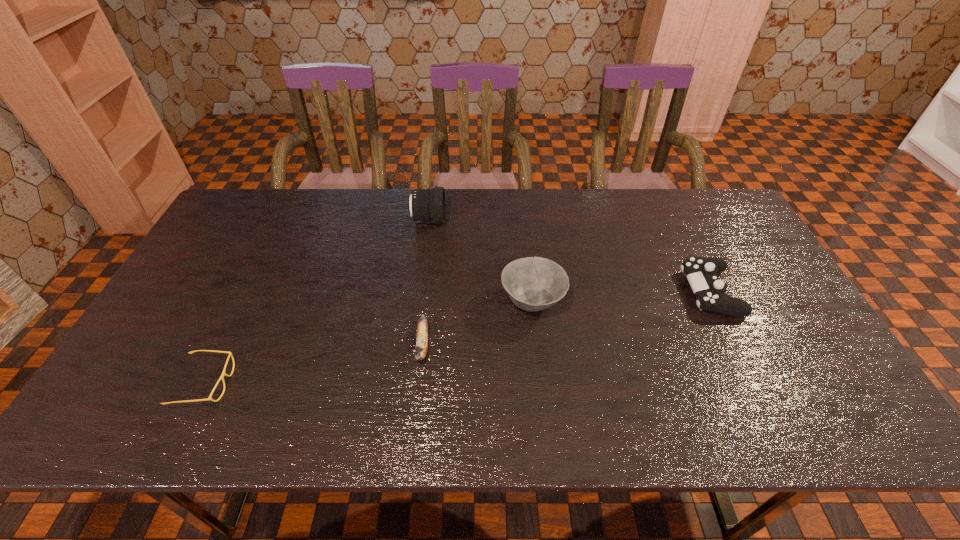
This screenshot has height=540, width=960. What are the coordinates of `free spot that satisfies the following two spatial constraints: 1. at the front element of the tallest object; 2. on the back side of the bowl` in the screenshot? It's located at (418, 301).

Find the location of `vacant space that satisfies the following two spatial constraints: 1. at the stem of the banana; 2. in front of the lenses of the spectacles`. vacant space that satisfies the following two spatial constraints: 1. at the stem of the banana; 2. in front of the lenses of the spectacles is located at coordinates (419, 383).

In order to click on free space that satisfies the following two spatial constraints: 1. at the stem of the banana; 2. in front of the lenses of the leftmost object in this screenshot , I will do `click(419, 383)`.

Locate an element on the screen. vacant region that satisfies the following two spatial constraints: 1. at the front element of the second object from right to left; 2. on the left side of the tallest object is located at coordinates (418, 301).

Locate an element on the screen. The width and height of the screenshot is (960, 540). free space that satisfies the following two spatial constraints: 1. at the front element of the farthest object; 2. on the back side of the fourth shortest object is located at coordinates (418, 301).